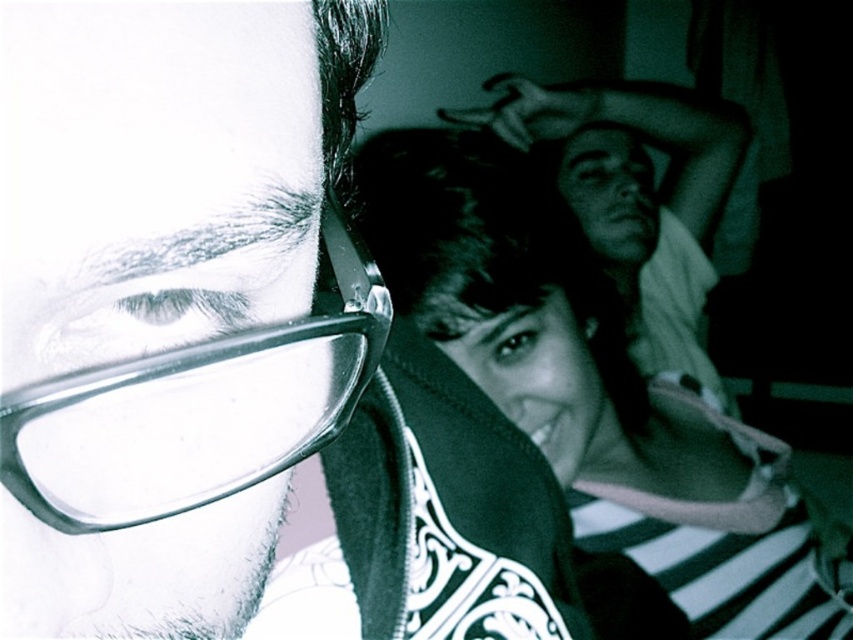
Between clear plastic glasses at center and smooth white shirt at upper right, which one is positioned lower?

clear plastic glasses at center is below.

Can you confirm if clear plastic glasses at center is positioned to the left of smooth white shirt at upper right?

Correct, you'll find clear plastic glasses at center to the left of smooth white shirt at upper right.

Between point (305, 349) and point (666, 244), which one is positioned behind?

Positioned behind is point (666, 244).

Where is `clear plastic glasses at center`? The height and width of the screenshot is (640, 853). clear plastic glasses at center is located at coordinates (196, 410).

Is matte black glasses at upper left taller than smooth white shirt at upper right?

No, matte black glasses at upper left is not taller than smooth white shirt at upper right.

Consider the image. Can you confirm if matte black glasses at upper left is positioned above smooth white shirt at upper right?

Incorrect, matte black glasses at upper left is not positioned above smooth white shirt at upper right.

Where is `matte black glasses at upper left`? The width and height of the screenshot is (853, 640). matte black glasses at upper left is located at coordinates (165, 173).

Where is `matte black glasses at upper left`? This screenshot has width=853, height=640. matte black glasses at upper left is located at coordinates (165, 173).

Who is more distant from viewer, [36,449] or [521,241]?

The point [521,241] is behind.

I want to click on matte black glasses at upper left, so click(165, 173).